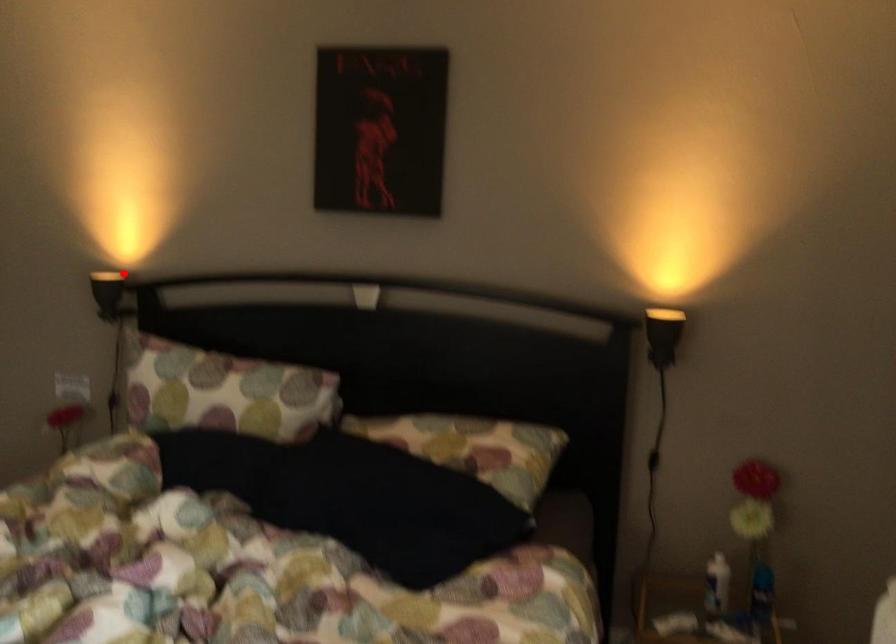
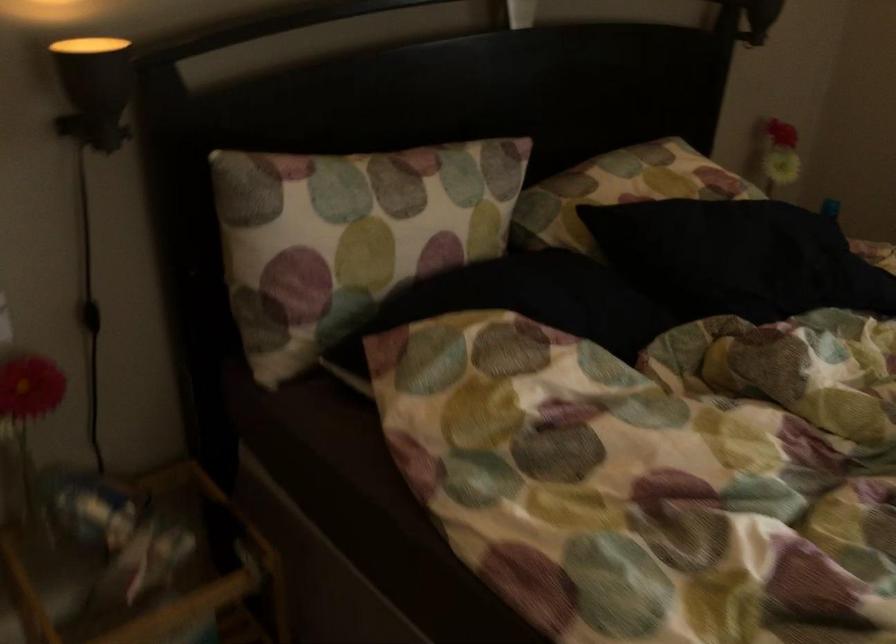
Find the pixel in the second image that matches the highlighted location in the first image.

(90, 48)